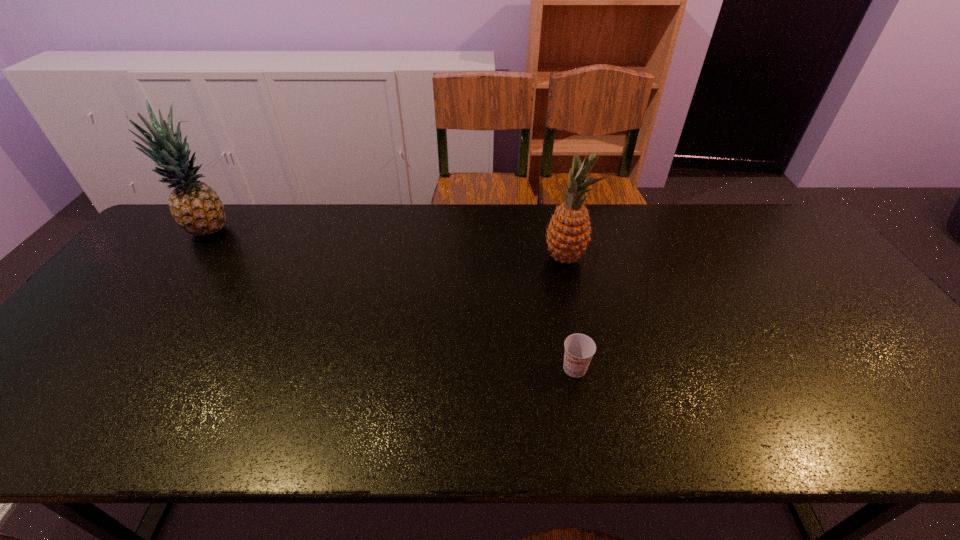
The image size is (960, 540). Identify the location of free space between the tallest object and the shorter pineapple. (388, 245).

Identify the location of vacant area that lies between the tallest object and the shortest object. (393, 300).

Where is `free point between the taller pineapple and the shorter pineapple`? This screenshot has height=540, width=960. free point between the taller pineapple and the shorter pineapple is located at coordinates (388, 245).

Image resolution: width=960 pixels, height=540 pixels. Identify the location of free point between the right pineapple and the Dixie cup. 570,313.

The width and height of the screenshot is (960, 540). What are the coordinates of `vacant area that lies between the taller pineapple and the right pineapple` in the screenshot? It's located at (388, 245).

Identify the location of object that can be found as the second closest to the tallest object. (579, 349).

The width and height of the screenshot is (960, 540). Find the location of `the second closest object to the shorter pineapple`. the second closest object to the shorter pineapple is located at coordinates (x=195, y=206).

The height and width of the screenshot is (540, 960). In order to click on free point that satisfies the following two spatial constraints: 1. on the front side of the tallest object; 2. on the left side of the shortest object in this screenshot , I will do `click(109, 368)`.

At what (x,y) coordinates should I click in order to perform the action: click on vacant area in the image that satisfies the following two spatial constraints: 1. on the back side of the nearest object; 2. on the left side of the shorter pineapple. Please return your answer as a coordinate pair (x, y). This screenshot has height=540, width=960. Looking at the image, I should click on (554, 258).

Identify the location of vacant space that satisfies the following two spatial constraints: 1. on the front side of the nearest object; 2. on the left side of the tallest object. Image resolution: width=960 pixels, height=540 pixels. (109, 368).